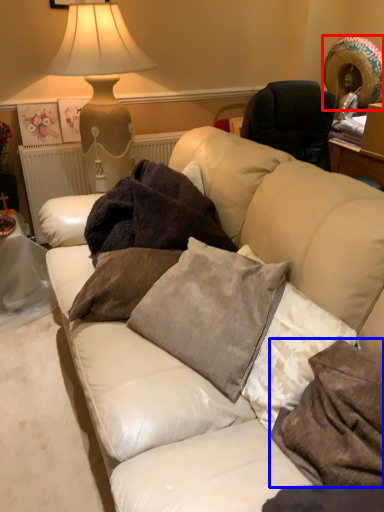
Question: Which point is further to the camera, straw hat (highlighted by a red box) or pillow (highlighted by a blue box)?

Choices:
 (A) straw hat
 (B) pillow

Answer: (A)